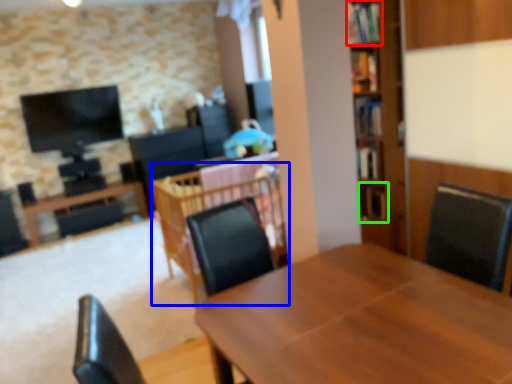
Question: Which object is positioned farthest from shelf (highlighted by a red box)? Select from table (highlighted by a blue box) and shelf (highlighted by a green box).

Choices:
 (A) table
 (B) shelf

Answer: (A)